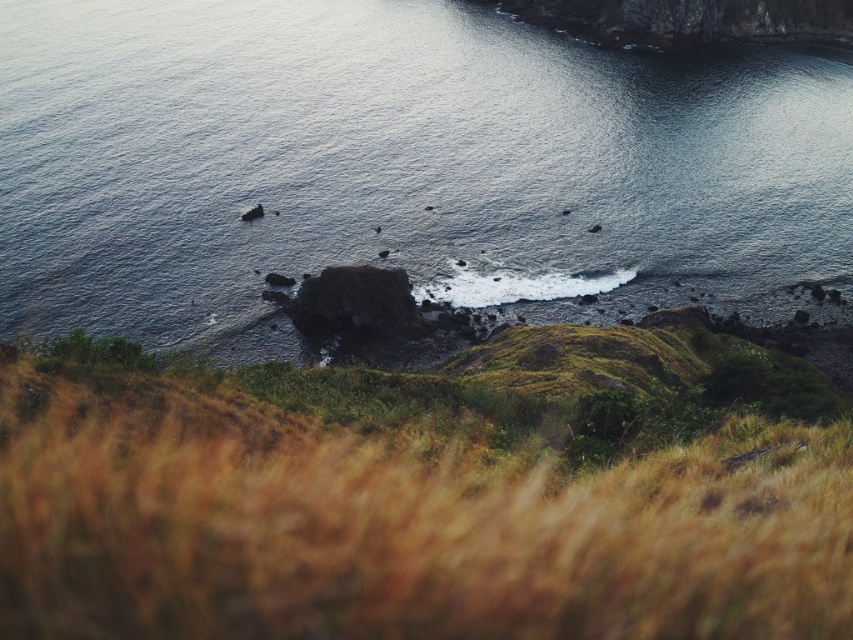
Measure the distance between dark blue water at center and brown grassy hillside at lower center.

dark blue water at center and brown grassy hillside at lower center are 77.39 meters apart from each other.

Does dark blue water at center have a greater height compared to brown grassy hillside at lower center?

Indeed, dark blue water at center has a greater height compared to brown grassy hillside at lower center.

Which is in front, point (28, 6) or point (20, 502)?

Point (20, 502)

Where is `dark blue water at center`? This screenshot has width=853, height=640. dark blue water at center is located at coordinates (399, 166).